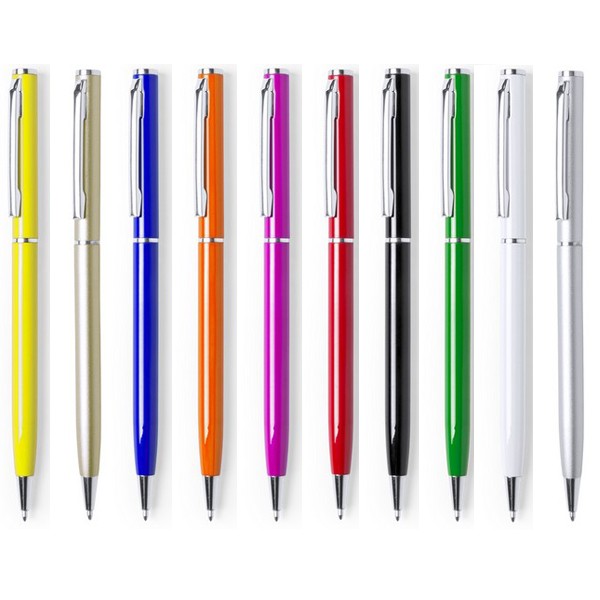
Locate an element on the screen. This screenshot has height=600, width=600. empty surface spaces between displayed pens is located at coordinates (59, 305), (115, 301), (175, 300), (247, 297), (308, 297), (367, 300), (430, 304), (489, 300), (544, 303).